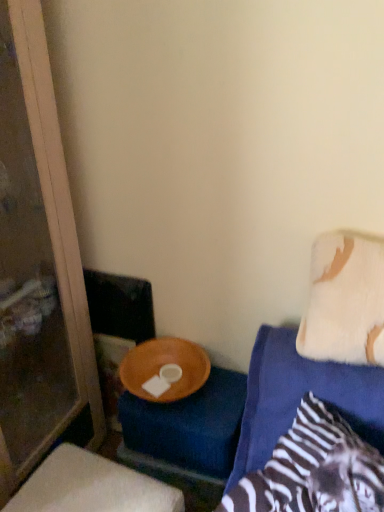
At what (x,y) coordinates should I click in order to perform the action: click on free space above wooden bowl at lower center (from a real-world perspective). Please return your answer as a coordinate pair (x, y). The height and width of the screenshot is (512, 384). Looking at the image, I should click on (86, 485).